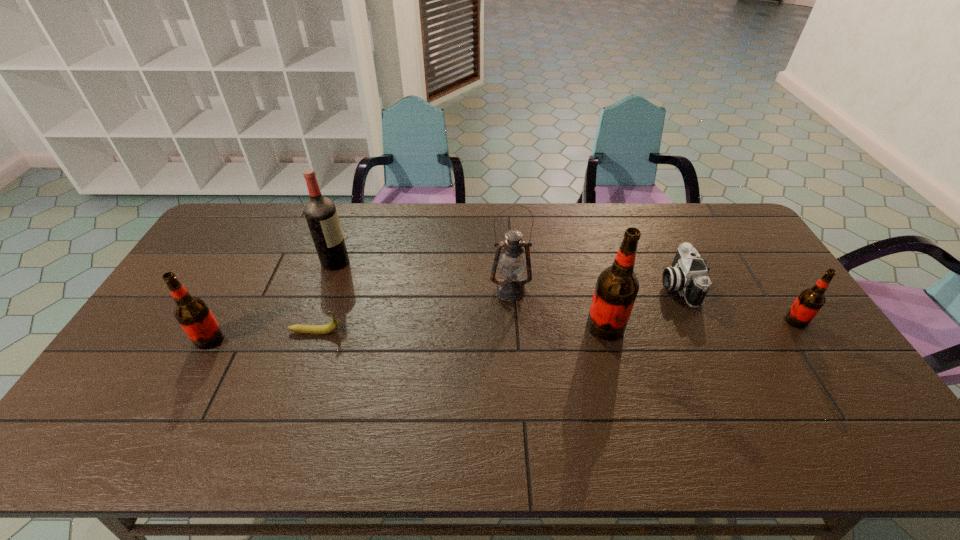
If equal spacing is desired by inserting an extra root_beer among them, please point out a free spot for this new root_beer. Please provide its 2D coordinates. Your answer should be formatted as a tuple, i.e. [(x, y)], where the tuple contains the x and y coordinates of a point satisfying the conditions above.

[(410, 333)]